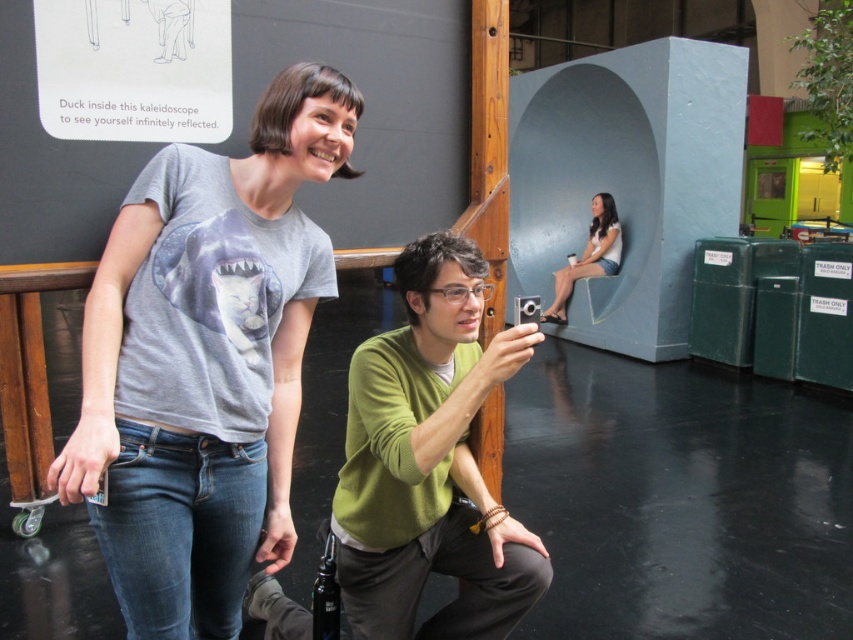
Does gray matte t-shirt at upper left come in front of white matte shirt at upper center?

Yes.

Between point (166, 236) and point (619, 234), which one is positioned in front?

Positioned in front is point (166, 236).

Is point (97, 380) less distant than point (579, 257)?

Yes, point (97, 380) is in front of point (579, 257).

Where is `gray matte t-shirt at upper left`? The height and width of the screenshot is (640, 853). gray matte t-shirt at upper left is located at coordinates (206, 362).

Between green matte sweater at center and white matte shirt at upper center, which one has less height?

Standing shorter between the two is green matte sweater at center.

Between green matte sweater at center and white matte shirt at upper center, which one appears on the left side from the viewer's perspective?

From the viewer's perspective, green matte sweater at center appears more on the left side.

Which is behind, point (434, 403) or point (583, 250)?

The point (583, 250) is behind.

You are a GUI agent. You are given a task and a screenshot of the screen. Output one action in this format:
    pyautogui.click(x=<x>, y=<y>)
    Task: Click on the green matte sweater at center
    The image size is (853, 640).
    Given the screenshot: What is the action you would take?
    pyautogui.click(x=430, y=461)

Is gray matte t-shirt at upper left positioned before green matte sweater at center?

Yes, gray matte t-shirt at upper left is in front of green matte sweater at center.

In the scene shown: Between gray matte t-shirt at upper left and green matte sweater at center, which one has less height?

With less height is green matte sweater at center.

Between point (112, 333) and point (498, 536), which one is positioned in front?

Point (112, 333) is more forward.

What are the coordinates of `gray matte t-shirt at upper left` in the screenshot? It's located at (206, 362).